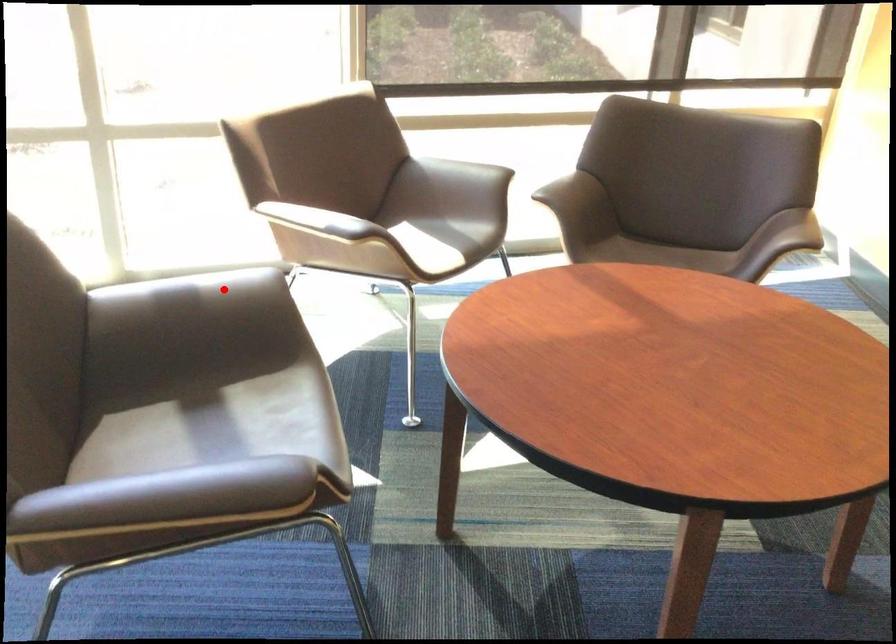
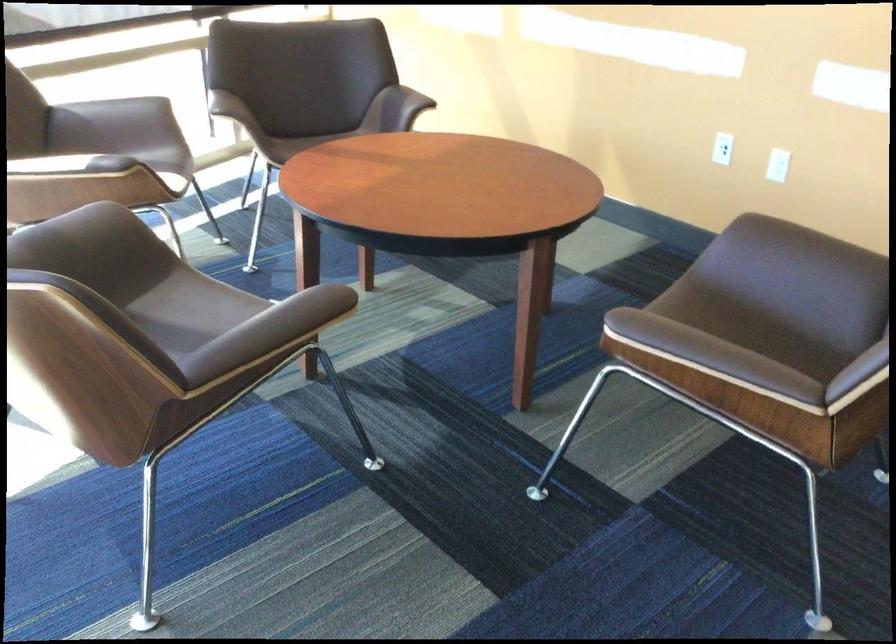
In the second image, find the point that corresponds to the highlighted location in the first image.

(76, 232)